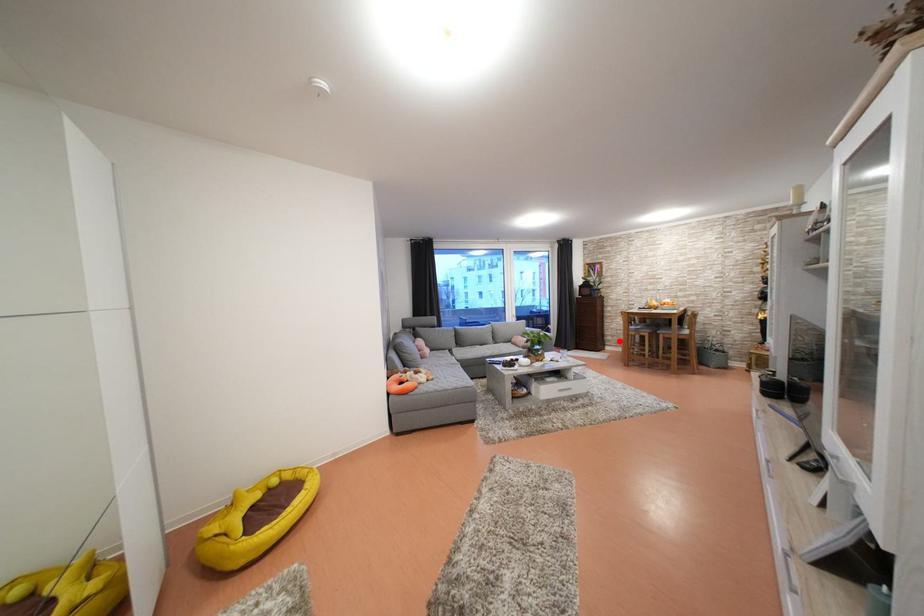
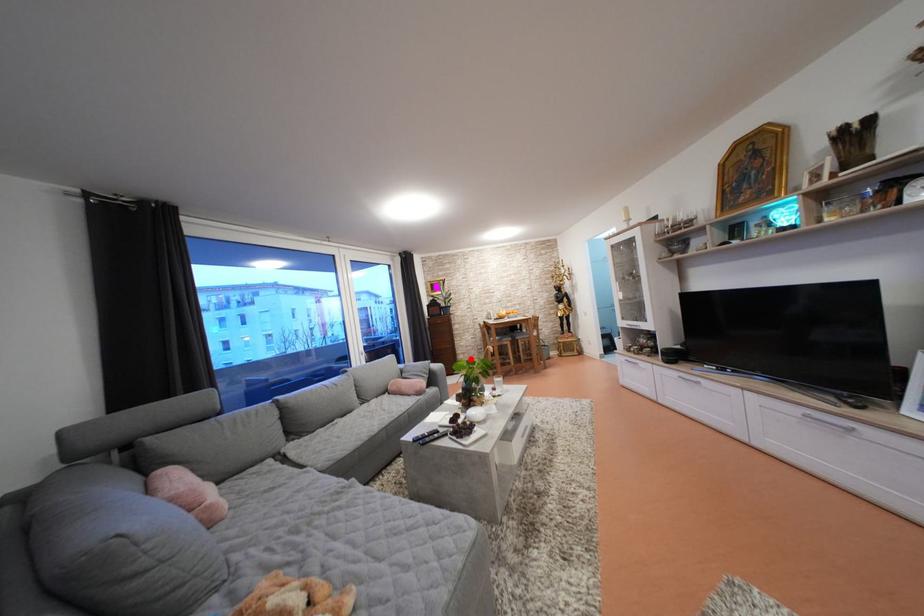
I am providing you with two images of the same scene from different viewpoints. A red point is marked on the first image and another point is marked on the second image. Is the marked point in image1 the same physical position as the marked point in image2?

Yes